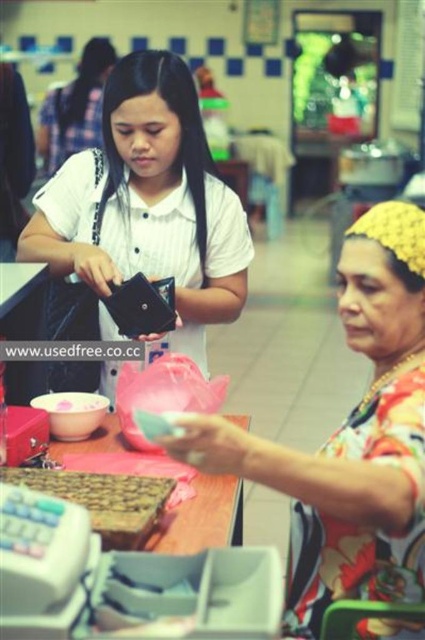
You are a customer in this food court and want to place an order. You see the floral fabric blouse at center and the wooden table at center. Which object is taller?

The floral fabric blouse at center is much taller than the wooden table at center.

You are a customer in this food court and you want to place your newly purchased drink on a flat surface. Which object can you use between the wooden tray at lower left and the wooden table at center?

The wooden tray at lower left is positioned over the wooden table at center, so you can place your drink on either surface. However, since the tray is on top of the table, the wooden table at center might provide a more stable and larger surface area for placing your drink.